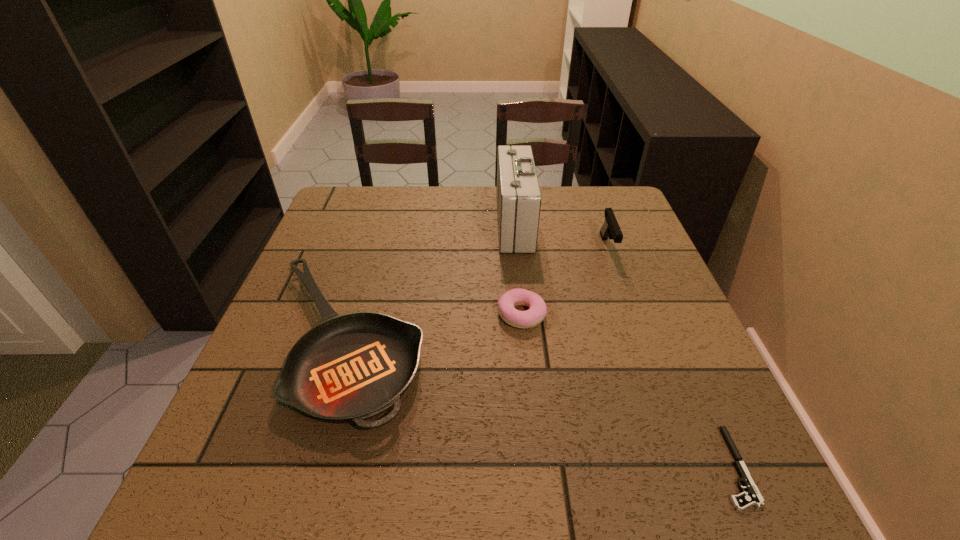
You are a GUI agent. You are given a task and a screenshot of the screen. Output one action in this format:
    pyautogui.click(x=<x>, y=<y>)
    Task: Click on the empty space between the leftmost object and the farther pistol
    
    Given the screenshot: What is the action you would take?
    pyautogui.click(x=476, y=294)

Locate an element on the screen. This screenshot has width=960, height=540. free space between the second object from right to left and the first-aid kit is located at coordinates (561, 236).

This screenshot has width=960, height=540. I want to click on empty space between the tallest object and the farther pistol, so (561, 236).

You are a GUI agent. You are given a task and a screenshot of the screen. Output one action in this format:
    pyautogui.click(x=<x>, y=<y>)
    Task: Click on the free spot between the shortest object and the farther pistol
    
    Given the screenshot: What is the action you would take?
    pyautogui.click(x=669, y=357)

At what (x,y) coordinates should I click in order to perform the action: click on vacant region between the second object from right to left and the rightmost object. Please return your answer as a coordinate pair (x, y). The image size is (960, 540). Looking at the image, I should click on (669, 357).

Find the location of a particular element. empty space that is in between the tallest object and the shortest object is located at coordinates (623, 346).

At what (x,y) coordinates should I click in order to perform the action: click on vacant area that lies between the right pistol and the pastry. Please return your answer as a coordinate pair (x, y). Image resolution: width=960 pixels, height=540 pixels. Looking at the image, I should click on (626, 391).

The image size is (960, 540). I want to click on object that can be found as the fourth closest to the left pistol, so click(752, 496).

Choose which object is the second nearest neighbor to the pastry. Please provide its 2D coordinates. Your answer should be formatted as a tuple, i.e. [(x, y)], where the tuple contains the x and y coordinates of a point satisfying the conditions above.

[(518, 196)]